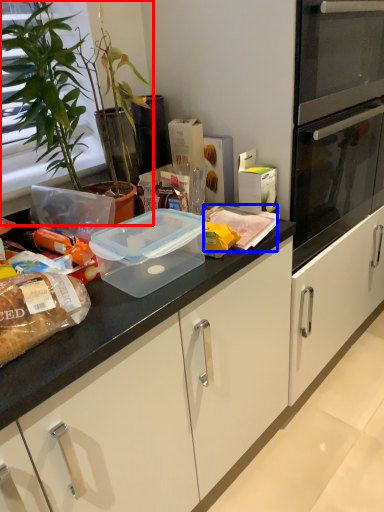
Question: Among these objects, which one is nearest to the camera, houseplant (highlighted by a red box) or food (highlighted by a blue box)?

Choices:
 (A) houseplant
 (B) food

Answer: (A)